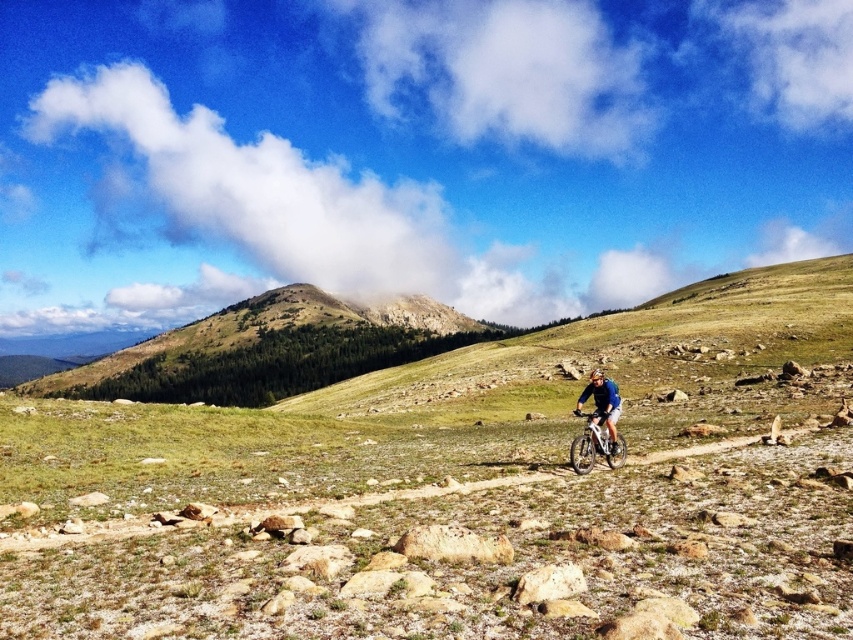
The height and width of the screenshot is (640, 853). In order to click on green forested mountain at upper center in this screenshot , I will do `click(270, 349)`.